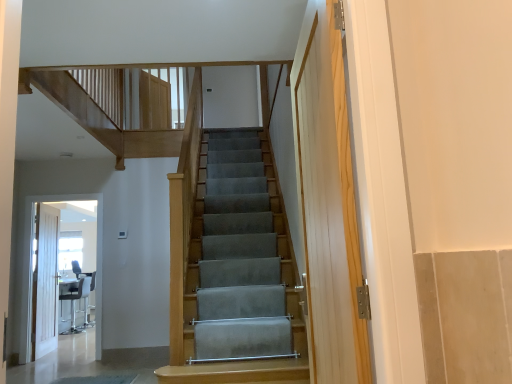
Question: From the image's perspective, is white glossy door at left beneath white painted wooden door at left?

Choices:
 (A) yes
 (B) no

Answer: (B)

Question: From a real-world perspective, is white glossy door at left physically above white painted wooden door at left?

Choices:
 (A) no
 (B) yes

Answer: (B)

Question: Can you confirm if white glossy door at left is shorter than white painted wooden door at left?

Choices:
 (A) no
 (B) yes

Answer: (A)

Question: Does white glossy door at left have a greater height compared to white painted wooden door at left?

Choices:
 (A) yes
 (B) no

Answer: (A)

Question: Is white glossy door at left smaller than white painted wooden door at left?

Choices:
 (A) yes
 (B) no

Answer: (B)

Question: From their relative heights in the image, would you say white glossy door at left is taller or shorter than matte black chair at lower left?

Choices:
 (A) tall
 (B) short

Answer: (A)

Question: Visually, is white glossy door at left positioned to the left or to the right of matte black chair at lower left?

Choices:
 (A) left
 (B) right

Answer: (B)

Question: Is white glossy door at left bigger or smaller than matte black chair at lower left?

Choices:
 (A) small
 (B) big

Answer: (A)

Question: Considering the positions of point (96, 279) and point (68, 332), is point (96, 279) closer or farther from the camera than point (68, 332)?

Choices:
 (A) closer
 (B) farther

Answer: (B)

Question: Looking at their shapes, would you say matte black chair at lower left is wider or thinner than white painted wooden door at left?

Choices:
 (A) thin
 (B) wide

Answer: (B)

Question: Is point (88, 289) positioned closer to the camera than point (56, 264)?

Choices:
 (A) farther
 (B) closer

Answer: (A)

Question: From a real-world perspective, relative to white painted wooden door at left, is matte black chair at lower left vertically above or below?

Choices:
 (A) above
 (B) below

Answer: (B)

Question: Is matte black chair at lower left bigger or smaller than white painted wooden door at left?

Choices:
 (A) big
 (B) small

Answer: (A)

Question: Is point (50, 291) positioned closer to the camera than point (98, 301)?

Choices:
 (A) closer
 (B) farther

Answer: (A)

Question: Is white painted wooden door at left to the left or to the right of white glossy door at left in the image?

Choices:
 (A) right
 (B) left

Answer: (B)